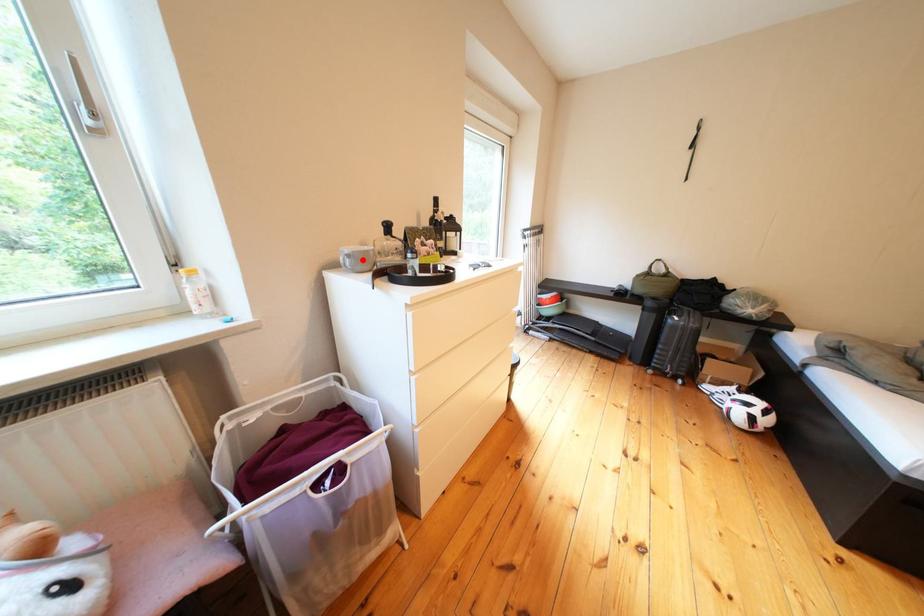
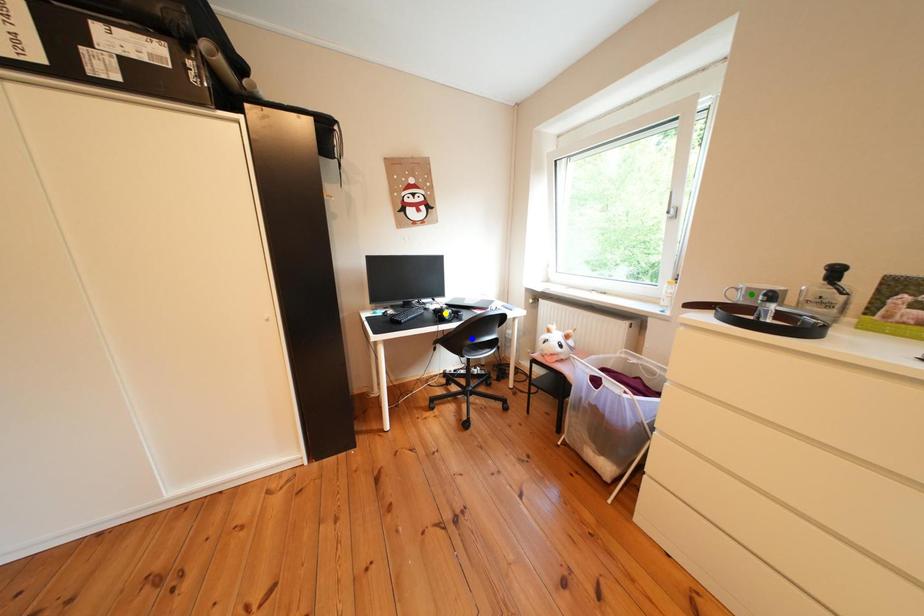
Question: I am providing you with two images of the same scene from different viewpoints. A red point is marked on the first image. You are given multiple points on the second image. Which spot in image 2 lines up with the point in image 1?

Choices:
 (A) yellow point
 (B) blue point
 (C) green point

Answer: (C)